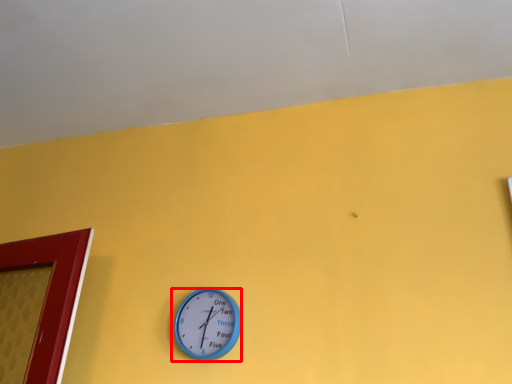
Question: From the image's perspective, where is wall clock (annotated by the red box) located relative to backdrop?

Choices:
 (A) above
 (B) below

Answer: (B)